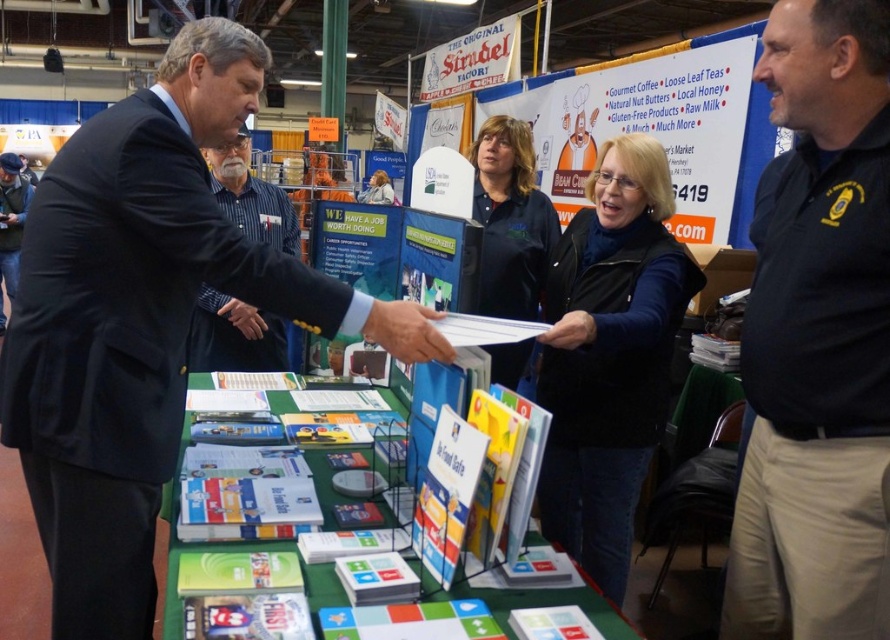
Between striped shirt at center and black leather hand at center, which one has more height?

Standing taller between the two is striped shirt at center.

Who is more forward, (257,316) or (231,307)?

Positioned in front is point (231,307).

Find the location of a particular element. The width and height of the screenshot is (890, 640). striped shirt at center is located at coordinates (233, 337).

From the picture: Between dark blue uniform at center and dark blue suit at left, which one is positioned lower?

dark blue uniform at center is lower down.

Is dark blue uniform at center taller than dark blue suit at left?

Incorrect, dark blue uniform at center's height is not larger of dark blue suit at left's.

At what (x,y) coordinates should I click in order to perform the action: click on dark blue uniform at center. Please return your answer as a coordinate pair (x, y). The image size is (890, 640). Looking at the image, I should click on click(x=510, y=220).

You are a GUI agent. You are given a task and a screenshot of the screen. Output one action in this format:
    pyautogui.click(x=<x>, y=<y>)
    Task: Click on the dark blue uniform at center
    This screenshot has height=640, width=890.
    Given the screenshot: What is the action you would take?
    pyautogui.click(x=510, y=220)

Does dark blue suit at center appear on the left side of matte black hand at center?

Yes, dark blue suit at center is to the left of matte black hand at center.

Which of these two, dark blue suit at center or matte black hand at center, stands taller?

Standing taller between the two is dark blue suit at center.

What do you see at coordinates (134, 320) in the screenshot? The height and width of the screenshot is (640, 890). I see `dark blue suit at center` at bounding box center [134, 320].

Locate an element on the screen. dark blue suit at center is located at coordinates (134, 320).